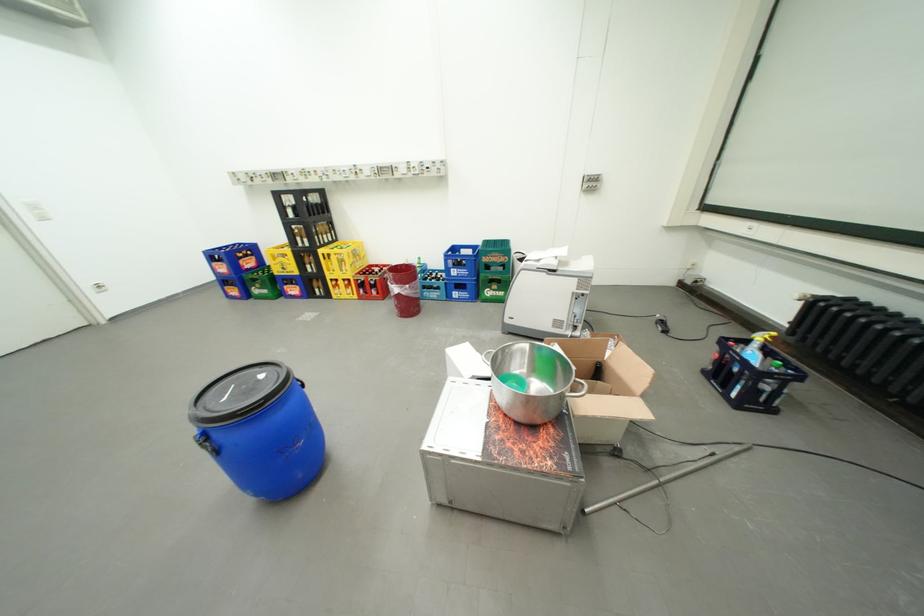
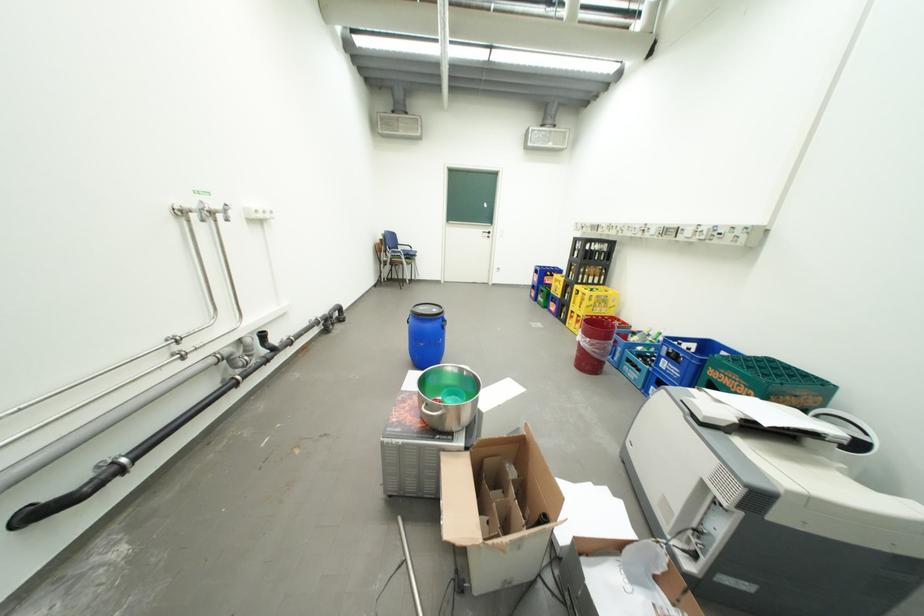
Locate, in the second image, the point that corresponds to point 418,286 in the first image.

(599, 341)